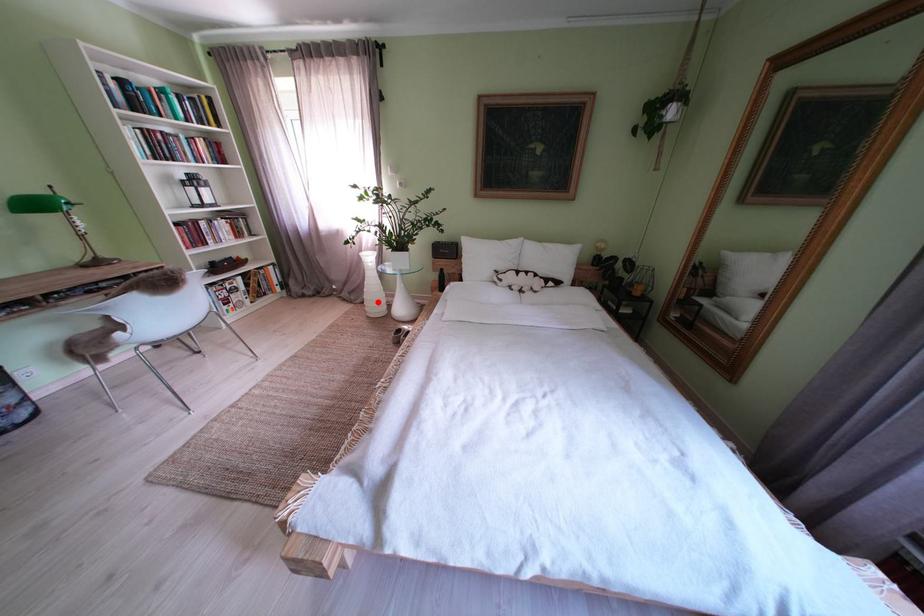
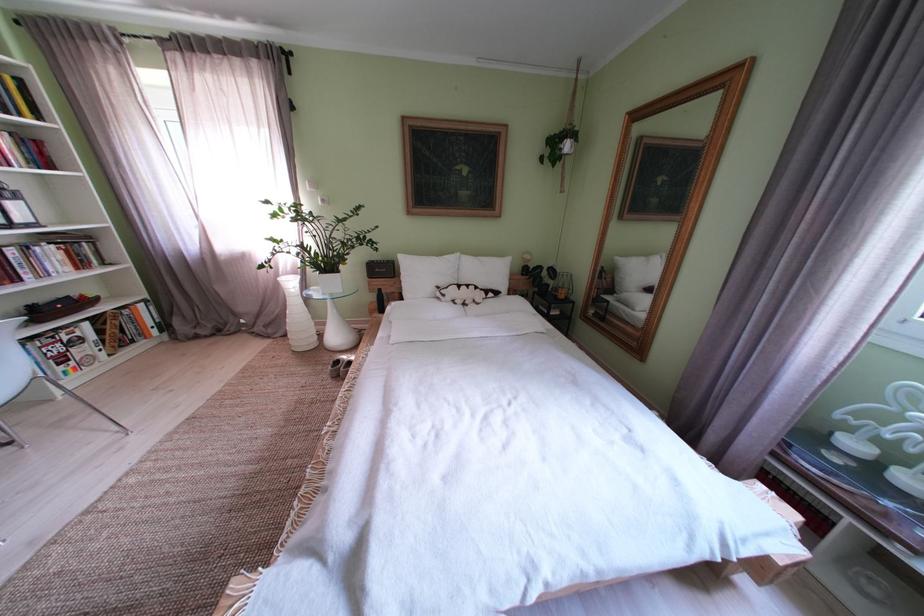
In the second image, find the point that corresponds to the highlighted location in the first image.

(301, 334)